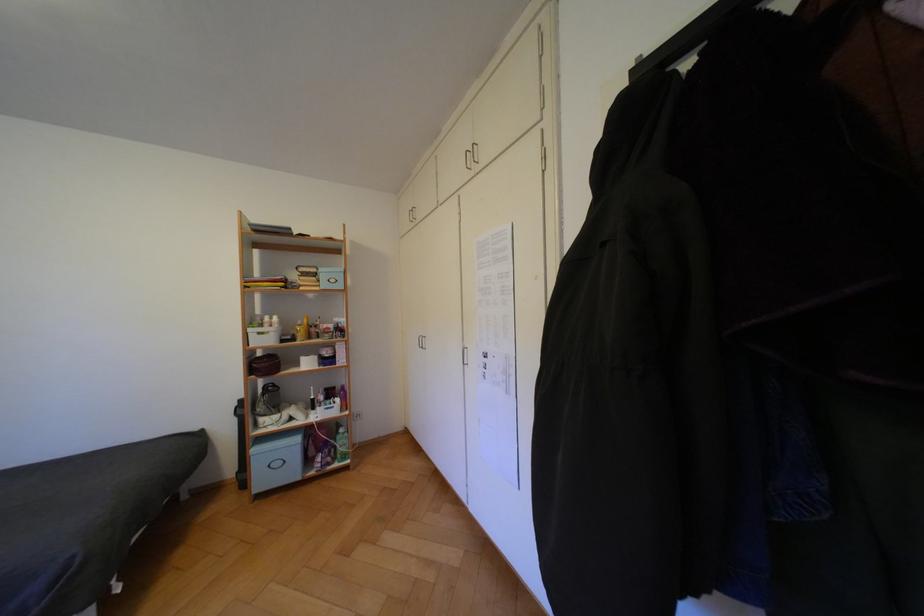
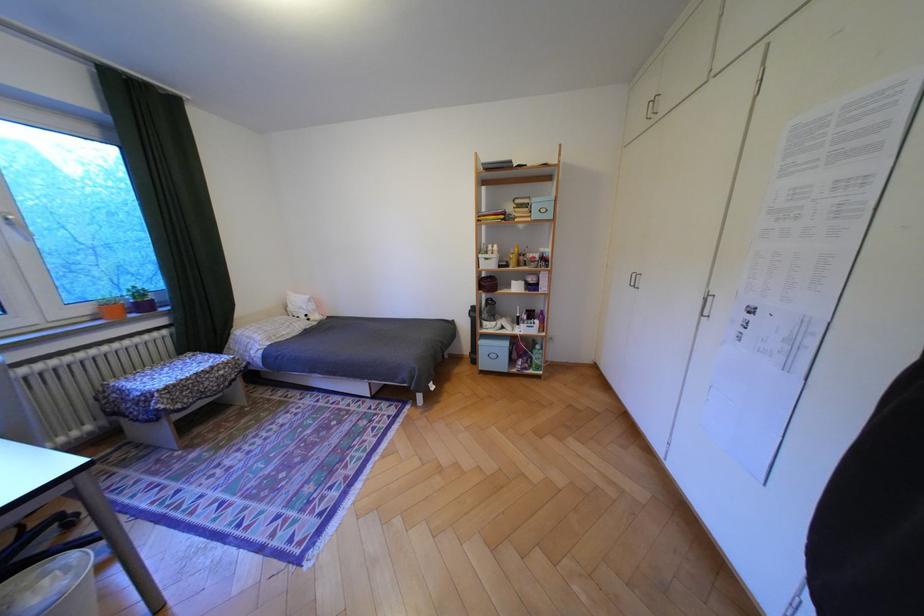
Where in the second image is the point corresponding to (x=274, y=480) from the first image?

(495, 363)